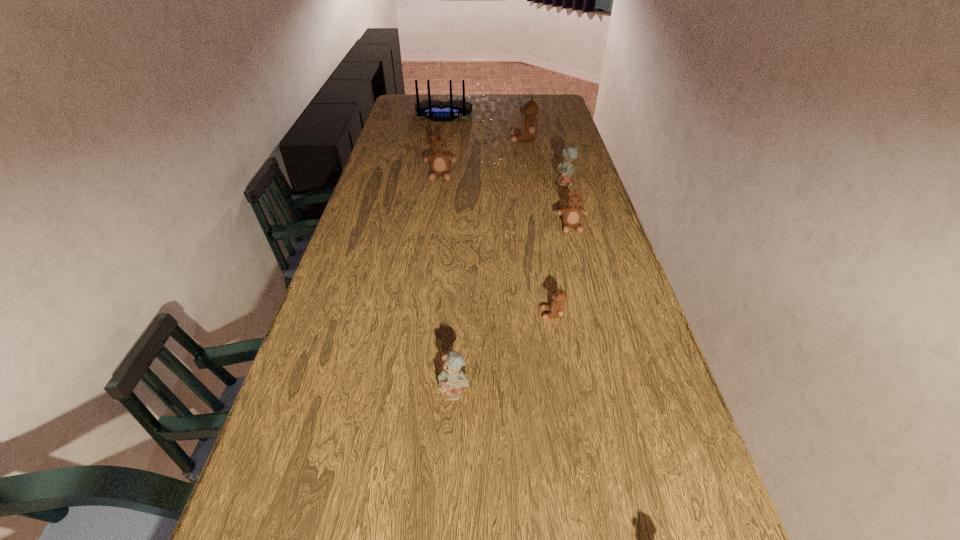
I want to click on the fifth closest object to the black router, so click(x=557, y=308).

Locate which object is the sixth closest to the nearest teddy bear. Please provide its 2D coordinates. Your answer should be formatted as a tuple, i.e. [(x, y)], where the tuple contains the x and y coordinates of a point satisfying the conditions above.

[(435, 110)]

At what (x,y) coordinates should I click in order to perform the action: click on teddy bear that is the third closest to the third farthest brown teddy bear. Please return your answer as a coordinate pair (x, y). Looking at the image, I should click on (440, 162).

The image size is (960, 540). In order to click on teddy bear that stands as the closest to the farthest object in this screenshot , I will do `click(529, 128)`.

At what (x,y) coordinates should I click in order to perform the action: click on brown teddy bear that stands as the closest to the nearest object. Please return your answer as a coordinate pair (x, y). This screenshot has height=540, width=960. Looking at the image, I should click on (557, 308).

Choose which brown teddy bear is the fourth nearest neighbor to the right blue teddy bear. Please provide its 2D coordinates. Your answer should be formatted as a tuple, i.e. [(x, y)], where the tuple contains the x and y coordinates of a point satisfying the conditions above.

[(557, 308)]

Locate an element on the screen. blue teddy bear that stands as the closest to the sixth nearest object is located at coordinates (565, 169).

Identify which blue teddy bear is the second nearest to the leftmost brown teddy bear. Please provide its 2D coordinates. Your answer should be formatted as a tuple, i.e. [(x, y)], where the tuple contains the x and y coordinates of a point satisfying the conditions above.

[(452, 381)]

At what (x,y) coordinates should I click in order to perform the action: click on free spot that satisfies the following two spatial constraints: 1. on the front-facing side of the sixth nearest object; 2. on the front-facing side of the nearest object. Please return your answer as a coordinate pair (x, y). This screenshot has height=540, width=960. Looking at the image, I should click on (564, 392).